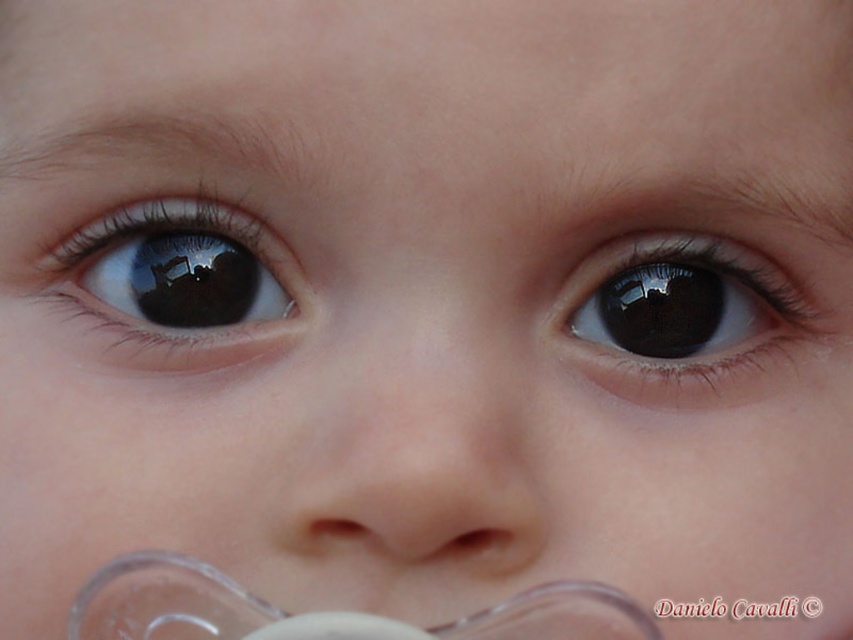
Can you confirm if black glossy eye at upper right is thinner than transparent plastic pacifier at lower center?

Yes.

Does black glossy eye at upper right lie in front of transparent plastic pacifier at lower center?

That is False.

The width and height of the screenshot is (853, 640). Identify the location of black glossy eye at upper right. (689, 320).

Who is higher up, blue glossy eye at upper left or transparent plastic pacifier at lower center?

blue glossy eye at upper left is higher up.

Between blue glossy eye at upper left and transparent plastic pacifier at lower center, which one appears on the right side from the viewer's perspective?

transparent plastic pacifier at lower center

Consider the image. Who is more distant from viewer, (299, 268) or (119, 572)?

The point (299, 268) is more distant.

Image resolution: width=853 pixels, height=640 pixels. Find the location of `blue glossy eye at upper left`. blue glossy eye at upper left is located at coordinates (178, 284).

Between smooth flesh nose at center and transparent plastic pacifier at lower center, which one has more height?

With more height is smooth flesh nose at center.

Can you confirm if smooth flesh nose at center is wider than transparent plastic pacifier at lower center?

Incorrect, smooth flesh nose at center's width does not surpass transparent plastic pacifier at lower center's.

The width and height of the screenshot is (853, 640). Identify the location of smooth flesh nose at center. (421, 449).